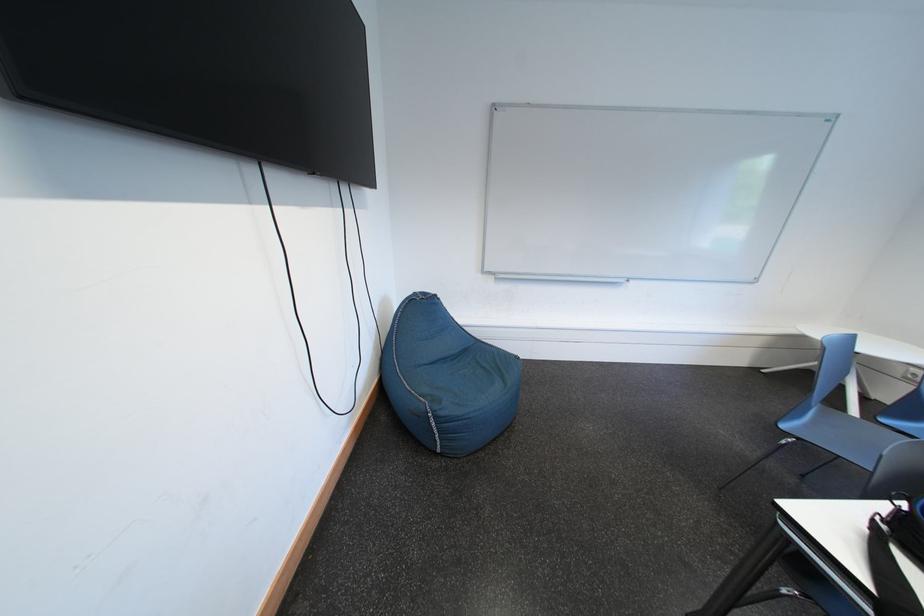
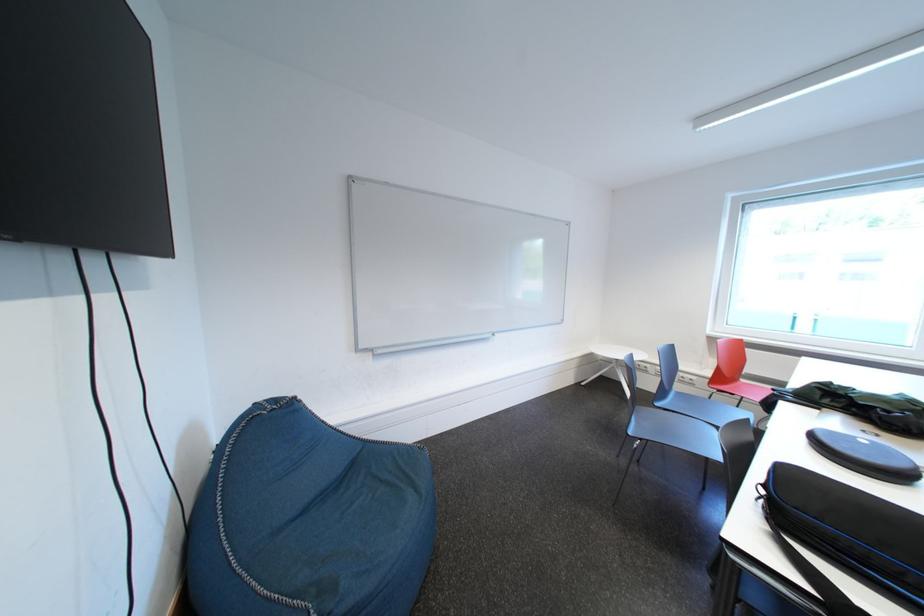
The point at (893, 424) is marked in the first image. Where is the corresponding point in the second image?

(666, 408)